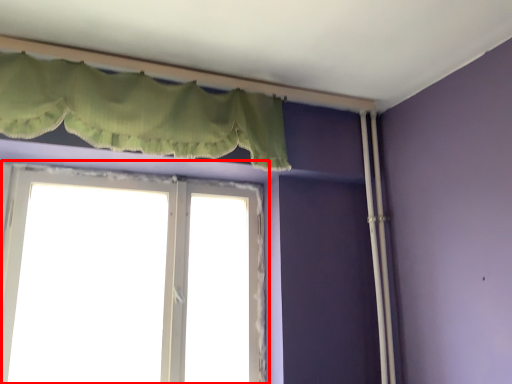
Question: Observing the image, what is the correct spatial positioning of window (annotated by the red box) in reference to curtain?

Choices:
 (A) right
 (B) left

Answer: (B)